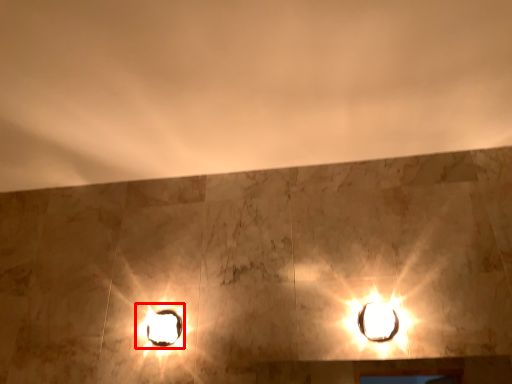
Question: In this image, where is stage light (annotated by the red box) located relative to lamp?

Choices:
 (A) left
 (B) right

Answer: (A)